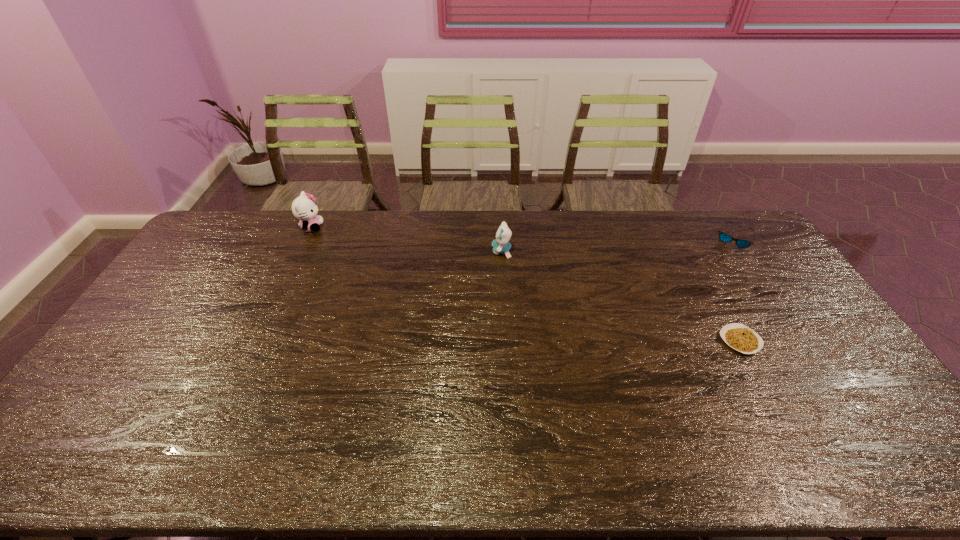
Where is `vacant point at the right edge`? This screenshot has width=960, height=540. vacant point at the right edge is located at coordinates (790, 291).

What are the coordinates of `vacant space at the near left corner` in the screenshot? It's located at (89, 473).

I want to click on unoccupied area between the shortest object and the leftmost object, so click(526, 284).

Where is `vacant space that is in between the sunglasses and the shortest object`? The image size is (960, 540). vacant space that is in between the sunglasses and the shortest object is located at coordinates (736, 289).

This screenshot has width=960, height=540. I want to click on free spot between the third tallest object and the right kitten, so click(617, 245).

Locate an element on the screen. Image resolution: width=960 pixels, height=540 pixels. free space between the legume and the second tallest object is located at coordinates (621, 296).

You are a GUI agent. You are given a task and a screenshot of the screen. Output one action in this format:
    pyautogui.click(x=<x>, y=<y>)
    Task: Click on the unoccupied area between the leftmost object and the third tallest object
    This screenshot has height=540, width=960.
    Given the screenshot: What is the action you would take?
    pyautogui.click(x=522, y=233)

The height and width of the screenshot is (540, 960). What are the coordinates of `vacant space that is in between the legume and the shorter kitten` in the screenshot? It's located at pyautogui.click(x=621, y=296).

Locate an element on the screen. unoccupied position between the right kitten and the second shortest object is located at coordinates (617, 245).

Identify the location of vacant area between the second object from right to left and the right kitten. (621, 296).